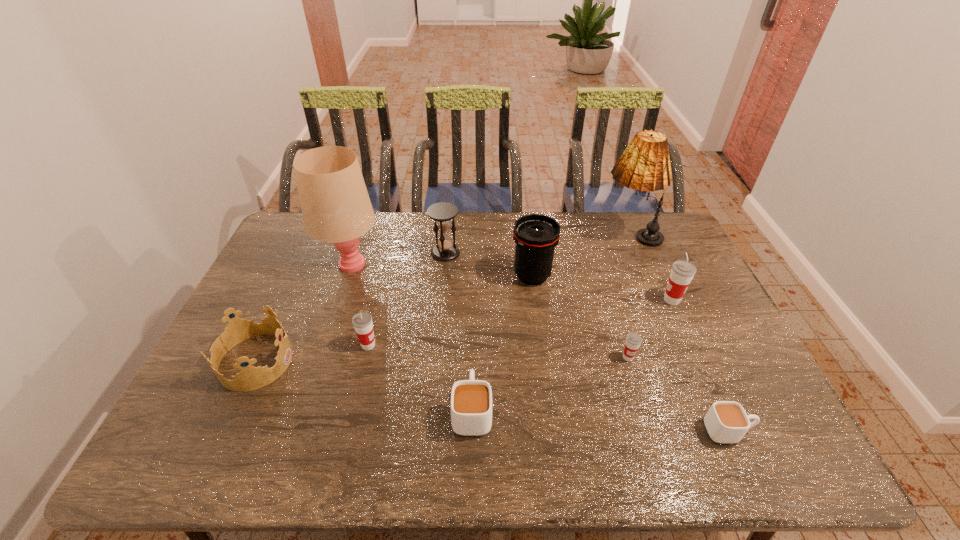
This screenshot has height=540, width=960. What are the coordinates of `vacant point located on the side with the handle of the sixth object from right to left` in the screenshot? It's located at (473, 297).

Where is `vacant space located on the side with the handle of the shortest cup`? The image size is (960, 540). vacant space located on the side with the handle of the shortest cup is located at coordinates (781, 431).

Identify the location of hourglass present at the far edge. (443, 213).

I want to click on object that is at the left edge, so click(x=250, y=378).

Identify the location of lampshade that is at the right edge. This screenshot has width=960, height=540. (645, 165).

What are the coordinates of `object present at the far right corner` in the screenshot? It's located at (645, 165).

Where is `object that is at the near right corner`? The height and width of the screenshot is (540, 960). object that is at the near right corner is located at coordinates (726, 421).

The width and height of the screenshot is (960, 540). What are the coordinates of `blank space at the far edge of the desktop` in the screenshot? It's located at (420, 223).

Locate an element on the screen. This screenshot has width=960, height=540. vacant region at the near edge of the desktop is located at coordinates (660, 440).

Where is `vacant space at the left edge of the desktop`? The height and width of the screenshot is (540, 960). vacant space at the left edge of the desktop is located at coordinates (284, 307).